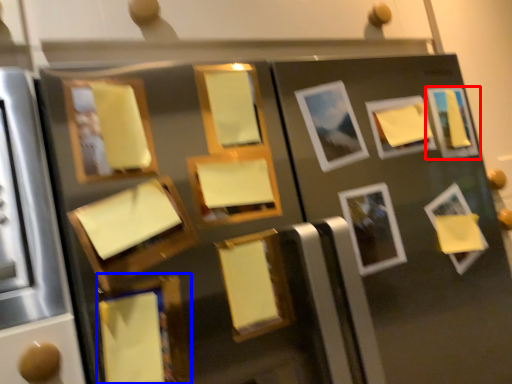
Question: Which of the following is the closest to the observer, picture frame (highlighted by a red box) or picture frame (highlighted by a blue box)?

Choices:
 (A) picture frame
 (B) picture frame

Answer: (B)